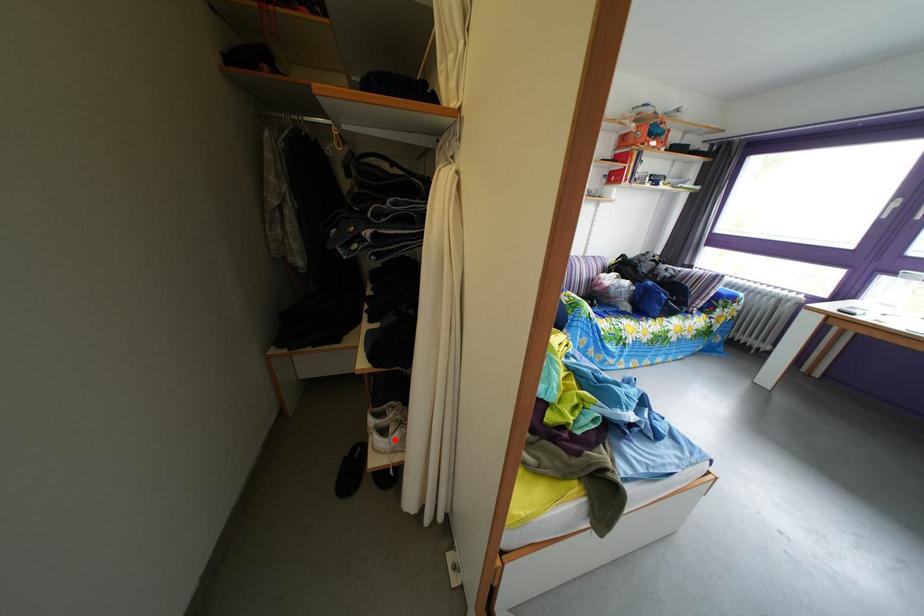
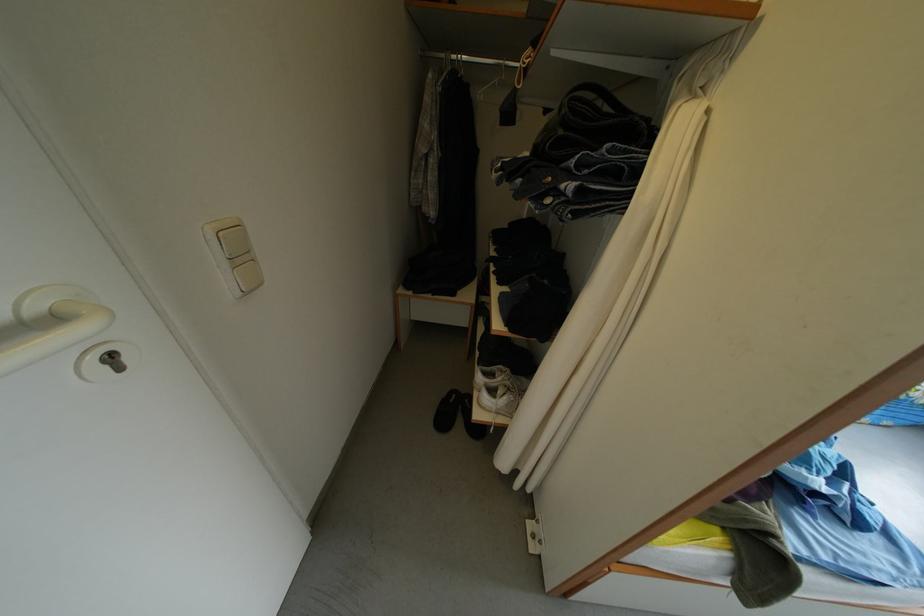
The point at the highlighted location is marked in the first image. Where is the corresponding point in the second image?

(503, 400)